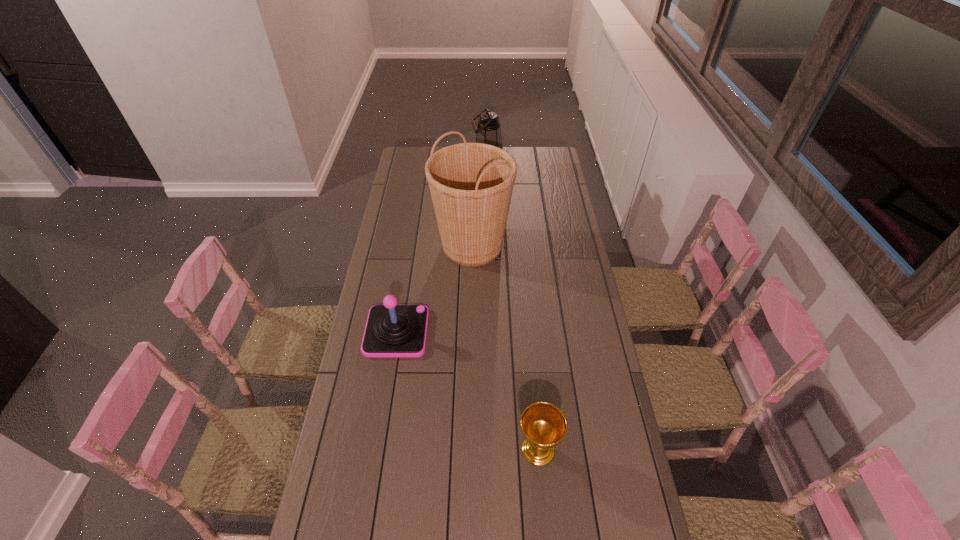
At what (x,y) coordinates should I click in order to perform the action: click on vacant space that is in between the joystick and the tallest object. Please return your answer as a coordinate pair (x, y). Looking at the image, I should click on (435, 289).

In order to click on free point between the chalice and the oil lamp in this screenshot , I will do `click(514, 311)`.

Choose which object is the second nearest neighbor to the tallest object. Please provide its 2D coordinates. Your answer should be formatted as a tuple, i.e. [(x, y)], where the tuple contains the x and y coordinates of a point satisfying the conditions above.

[(488, 131)]

Identify which object is the third closest to the tallest object. Please provide its 2D coordinates. Your answer should be formatted as a tuple, i.e. [(x, y)], where the tuple contains the x and y coordinates of a point satisfying the conditions above.

[(543, 425)]

Locate an element on the screen. The image size is (960, 540). vacant space that satisfies the following two spatial constraints: 1. forward from the base of the joystick; 2. on the back side of the chalice is located at coordinates (377, 449).

Where is `free location that satisfies the following two spatial constraints: 1. forward from the base of the chalice; 2. on the left side of the second nearest object`? The image size is (960, 540). free location that satisfies the following two spatial constraints: 1. forward from the base of the chalice; 2. on the left side of the second nearest object is located at coordinates (377, 449).